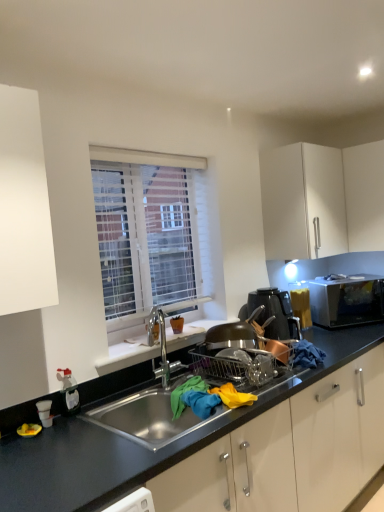
Question: Would you say satin silver microwave at right is inside or outside white matte window sill at center?

Choices:
 (A) inside
 (B) outside

Answer: (B)

Question: Considering the positions of point (332, 324) and point (168, 333), is point (332, 324) closer or farther from the camera than point (168, 333)?

Choices:
 (A) closer
 (B) farther

Answer: (B)

Question: Which object is positioned farthest from the satin silver microwave at right?

Choices:
 (A) white matte cabinet at upper right
 (B) metallic copper pot at right
 (C) stainless steel sink at center
 (D) white textured blinds at upper center
 (E) white matte window sill at center

Answer: (C)

Question: Which object is positioned farthest from the satin silver microwave at right?

Choices:
 (A) white matte cabinet at upper right
 (B) white matte window sill at center
 (C) white textured blinds at upper center
 (D) metallic copper pot at right
 (E) stainless steel sink at center

Answer: (E)